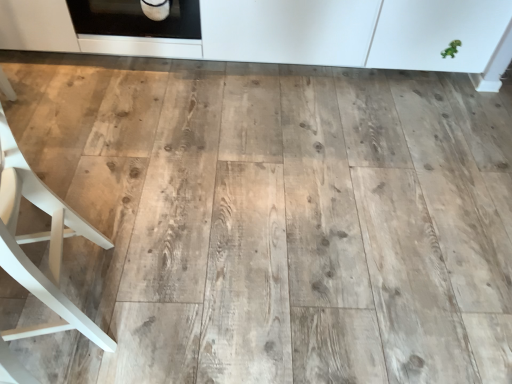
What are the coordinates of `vacant space to the right of white wood chair at left` in the screenshot? It's located at (173, 292).